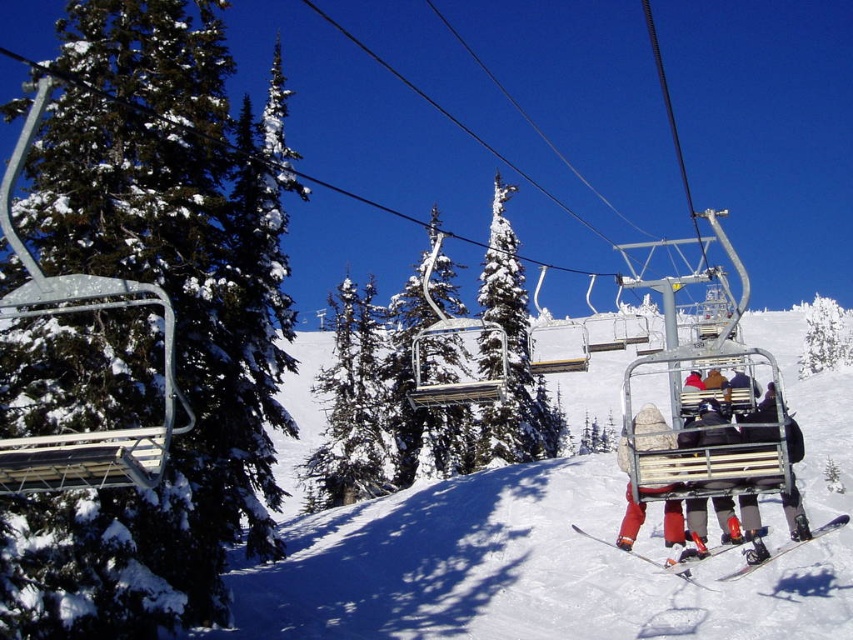
Question: Does green matte tree at left appear on the right side of snow-covered evergreen at center?

Choices:
 (A) yes
 (B) no

Answer: (B)

Question: Which of the following is the farthest from the observer?

Choices:
 (A) green textured pine tree at center
 (B) snow-covered evergreen at center

Answer: (A)

Question: Is matte black jacket at center wider than metallic silver ski lift at center?

Choices:
 (A) yes
 (B) no

Answer: (B)

Question: Which object is closer to the camera taking this photo?

Choices:
 (A) matte black ski at lower right
 (B) white metallic ski at lower right
 (C) matte black ski boots at lower right

Answer: (C)

Question: Which point is closer to the camera?

Choices:
 (A) matte black jacket at center
 (B) white metallic ski at lower right

Answer: (A)

Question: Can you confirm if matte black ski boots at lower right is smaller than matte black jacket at center?

Choices:
 (A) no
 (B) yes

Answer: (A)